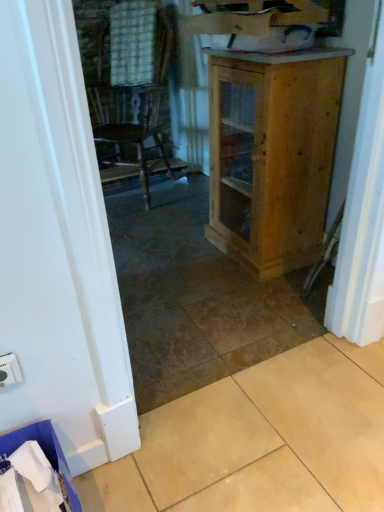
Question: Considering the relative sizes of natural wood cabinet at center and beige tile at lower right in the image provided, is natural wood cabinet at center wider than beige tile at lower right?

Choices:
 (A) no
 (B) yes

Answer: (A)

Question: From a real-world perspective, is natural wood cabinet at center on top of beige tile at lower right?

Choices:
 (A) no
 (B) yes

Answer: (B)

Question: Is natural wood cabinet at center to the left of beige tile at lower right from the viewer's perspective?

Choices:
 (A) yes
 (B) no

Answer: (B)

Question: Is the depth of natural wood cabinet at center greater than that of beige tile at lower right?

Choices:
 (A) yes
 (B) no

Answer: (A)

Question: From a real-world perspective, is natural wood cabinet at center below beige tile at lower right?

Choices:
 (A) yes
 (B) no

Answer: (B)

Question: Is natural wood cabinet at center oriented towards beige tile at lower right?

Choices:
 (A) yes
 (B) no

Answer: (B)

Question: Is white plastic electric outlet at lower left positioned with its back to beige tile at lower right?

Choices:
 (A) yes
 (B) no

Answer: (B)

Question: Does white plastic electric outlet at lower left appear on the left side of beige tile at lower right?

Choices:
 (A) yes
 (B) no

Answer: (A)

Question: Does white plastic electric outlet at lower left appear on the right side of beige tile at lower right?

Choices:
 (A) no
 (B) yes

Answer: (A)

Question: Is white plastic electric outlet at lower left thinner than beige tile at lower right?

Choices:
 (A) yes
 (B) no

Answer: (A)

Question: Considering the relative sizes of white plastic electric outlet at lower left and beige tile at lower right in the image provided, is white plastic electric outlet at lower left wider than beige tile at lower right?

Choices:
 (A) yes
 (B) no

Answer: (B)

Question: Is white plastic electric outlet at lower left positioned behind beige tile at lower right?

Choices:
 (A) no
 (B) yes

Answer: (B)

Question: Is beige tile at lower right positioned before white plastic electric outlet at lower left?

Choices:
 (A) yes
 (B) no

Answer: (A)